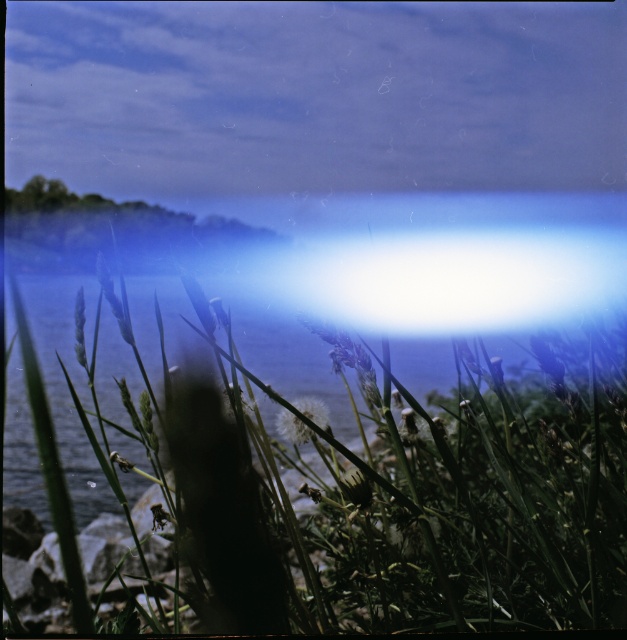
Question: Which object is farther from the camera taking this photo?

Choices:
 (A) green grass at lower left
 (B) white fluffy flower at center

Answer: (B)

Question: Does green grass at lower left have a smaller size compared to white fluffy flower at center?

Choices:
 (A) yes
 (B) no

Answer: (B)

Question: Does green grass at lower left have a lesser width compared to white fluffy flower at center?

Choices:
 (A) yes
 (B) no

Answer: (B)

Question: Among these points, which one is farthest from the camera?

Choices:
 (A) (322, 406)
 (B) (268, 467)

Answer: (A)

Question: Can you confirm if green grass at lower left is positioned below white fluffy flower at center?

Choices:
 (A) no
 (B) yes

Answer: (B)

Question: Among these objects, which one is farthest from the camera?

Choices:
 (A) white fluffy flower at center
 (B) green grass at lower left

Answer: (A)